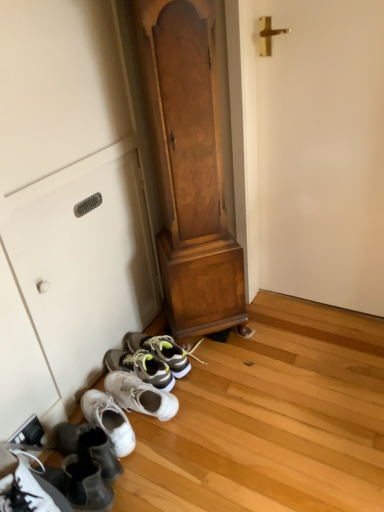
The image size is (384, 512). What do you see at coordinates (70, 202) in the screenshot? I see `white matte cabinet at lower left` at bounding box center [70, 202].

I want to click on white matte door at right, so click(x=322, y=152).

What do you see at coordinates (322, 152) in the screenshot?
I see `white matte door at right` at bounding box center [322, 152].

The image size is (384, 512). What do you see at coordinates (189, 166) in the screenshot?
I see `wooden dresser at center` at bounding box center [189, 166].

I want to click on white matte cabinet at lower left, so [70, 202].

Is white matte door at right facing towards wooden dresser at center?

No, white matte door at right is not oriented towards wooden dresser at center.

Is white matte door at right spatially inside wooden dresser at center, or outside of it?

white matte door at right is not enclosed by wooden dresser at center.

From the image's perspective, is white matte door at right above wooden dresser at center?

Yes, from the image's perspective, white matte door at right is above wooden dresser at center.

Does wooden dresser at center come behind white matte door at right?

No, wooden dresser at center is in front of white matte door at right.

Considering the relative sizes of wooden dresser at center and white matte door at right in the image provided, is wooden dresser at center smaller than white matte door at right?

Actually, wooden dresser at center might be larger than white matte door at right.

You are a GUI agent. You are given a task and a screenshot of the screen. Output one action in this format:
    pyautogui.click(x=<x>, y=<y>)
    Task: Click on the dresser on the left of white matte door at right
    The image size is (384, 512).
    Given the screenshot: What is the action you would take?
    pyautogui.click(x=189, y=166)

From a real-world perspective, does wooden dresser at center sit lower than white matte door at right?

Incorrect, from a real-world perspective, wooden dresser at center is higher than white matte door at right.

Does point (273, 234) lie in front of point (41, 118)?

No, it is behind (41, 118).

Does white matte door at right appear on the right side of white matte cabinet at lower left?

Yes.

Where is `cabinetry behind the white matte door at right`? The height and width of the screenshot is (512, 384). cabinetry behind the white matte door at right is located at coordinates (70, 202).

From a real-world perspective, is white matte door at right physically above white matte cabinet at lower left?

Yes, from a real-world perspective, white matte door at right is on top of white matte cabinet at lower left.

From the image's perspective, which is below, wooden dresser at center or white matte cabinet at lower left?

white matte cabinet at lower left appears lower in the image.

Which of these two, wooden dresser at center or white matte cabinet at lower left, stands taller?

Standing taller between the two is wooden dresser at center.

Based on their sizes in the image, would you say wooden dresser at center is bigger or smaller than white matte cabinet at lower left?

Considering their sizes, wooden dresser at center takes up more space than white matte cabinet at lower left.

How many degrees apart are the facing directions of wooden dresser at center and white matte cabinet at lower left?

The angle between the facing direction of wooden dresser at center and the facing direction of white matte cabinet at lower left is 45.2 degrees.

From the image's perspective, between white suede shoes at lower left and white matte cabinet at lower left, which one is located above?

white matte cabinet at lower left, from the image's perspective.

Is white suede shoes at lower left wider than white matte cabinet at lower left?

Yes, white suede shoes at lower left is wider than white matte cabinet at lower left.

Is white suede shoes at lower left to the left or to the right of white matte cabinet at lower left in the image?

Clearly, white suede shoes at lower left is on the left of white matte cabinet at lower left in the image.

Between white matte door at right and white suede shoes at lower left, which one has larger width?

white suede shoes at lower left is wider.

Which is behind, white matte door at right or white suede shoes at lower left?

white matte door at right is further from the camera.

Is white matte door at right looking in the opposite direction of white suede shoes at lower left?

No, white matte door at right is not facing away from white suede shoes at lower left.

Can you tell me how much white matte door at right and white suede shoes at lower left differ in facing direction?

76.1 degrees separate the facing orientations of white matte door at right and white suede shoes at lower left.

Is white matte cabinet at lower left in front of or behind white matte door at right in the image?

In the image, white matte cabinet at lower left appears behind white matte door at right.

From a real-world perspective, is white matte cabinet at lower left above or below white matte door at right?

From a real-world perspective, white matte cabinet at lower left is physically below white matte door at right.

From the image's perspective, is white matte cabinet at lower left over white matte door at right?

No.

Can you tell me how much white matte cabinet at lower left and white matte door at right differ in facing direction?

white matte cabinet at lower left and white matte door at right are facing 90 degrees away from each other.

The image size is (384, 512). In order to click on door below the wooden dresser at center (from a real-world perspective) in this screenshot , I will do `click(322, 152)`.

Locate an element on the screen. Image resolution: width=384 pixels, height=512 pixels. dresser below the white matte door at right (from the image's perspective) is located at coordinates coord(189,166).

Which object lies nearer to the anchor point wooden dresser at center, white matte door at right or white matte cabinet at lower left?

white matte cabinet at lower left is positioned closer to the anchor wooden dresser at center.

From the image, which object appears to be nearer to white matte door at right, white suede shoes at lower left or wooden dresser at center?

wooden dresser at center lies closer to white matte door at right than the other object.

When comparing their distances from wooden dresser at center, does white matte cabinet at lower left or white matte door at right seem further?

white matte door at right is positioned further to the anchor wooden dresser at center.

From the image, which object appears to be nearer to white suede shoes at lower left, white matte door at right or white matte cabinet at lower left?

Based on the image, white matte cabinet at lower left appears to be nearer to white suede shoes at lower left.

Considering their positions, is wooden dresser at center positioned closer to white suede shoes at lower left than white matte door at right?

wooden dresser at center lies closer to white suede shoes at lower left than the other object.

When comparing their distances from wooden dresser at center, does white matte door at right or white suede shoes at lower left seem further?

white suede shoes at lower left.

From the image, which object appears to be nearer to white suede shoes at lower left, wooden dresser at center or white matte cabinet at lower left?

white matte cabinet at lower left.

Estimate the real-world distances between objects in this image. Which object is closer to white matte cabinet at lower left, wooden dresser at center or white matte door at right?

wooden dresser at center is closer to white matte cabinet at lower left.

At what (x,y) coordinates should I click in order to perform the action: click on dresser between white matte cabinet at lower left and white matte door at right. Please return your answer as a coordinate pair (x, y). Looking at the image, I should click on (189, 166).

You are a GUI agent. You are given a task and a screenshot of the screen. Output one action in this format:
    pyautogui.click(x=<x>, y=<y>)
    Task: Click on the cabinetry between wooden dresser at center and white suede shoes at lower left in the vertical direction
    
    Given the screenshot: What is the action you would take?
    pyautogui.click(x=70, y=202)

The width and height of the screenshot is (384, 512). What are the coordinates of `cabinetry between white suede shoes at lower left and white matte door at right` in the screenshot? It's located at (70, 202).

Identify the location of dresser between white matte door at right and white suede shoes at lower left in the up-down direction. The height and width of the screenshot is (512, 384). (189, 166).